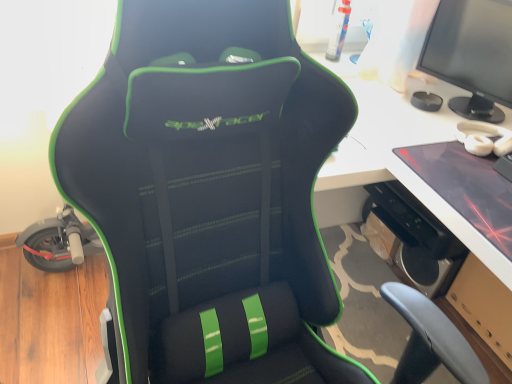
At what (x,y) coordinates should I click in order to perform the action: click on free spot to the left of matte black monitor at upper right. Please return your answer as a coordinate pair (x, y). Looking at the image, I should click on (388, 105).